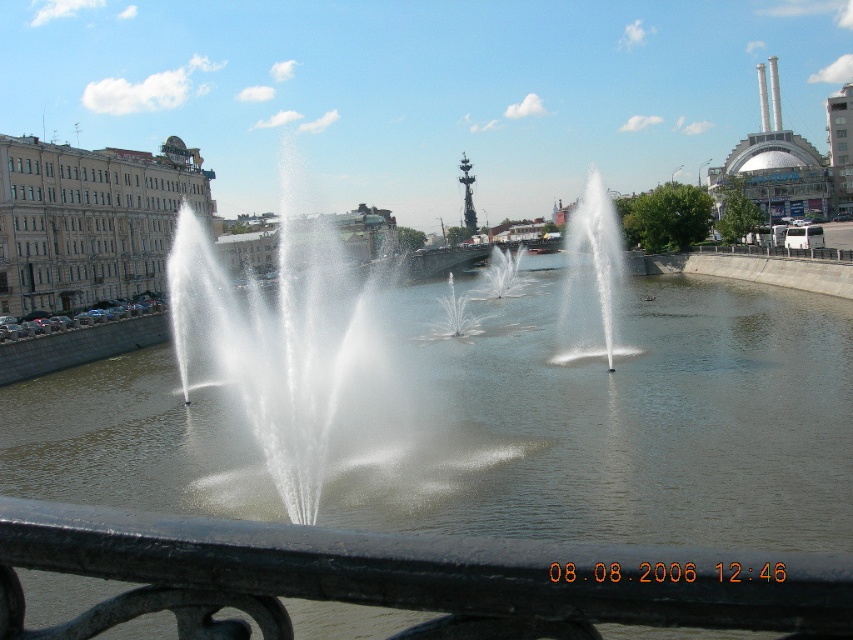
Who is positioned more to the left, brown concrete river at center or black metal rail at lower center?

Positioned to the left is brown concrete river at center.

Can you confirm if brown concrete river at center is bigger than black metal rail at lower center?

Yes.

Is point (219, 396) farther from viewer compared to point (283, 634)?

Yes, it is behind point (283, 634).

Locate an element on the screen. Image resolution: width=853 pixels, height=640 pixels. brown concrete river at center is located at coordinates (619, 420).

Between black metal rail at lower center and white frothy water at center, which one is positioned higher?

Positioned higher is white frothy water at center.

Is point (415, 596) farther from camera compared to point (592, 170)?

No, (415, 596) is in front of (592, 170).

Based on the photo, who is more forward, (669, 568) or (569, 323)?

Point (669, 568) is in front.

The width and height of the screenshot is (853, 640). Find the location of `black metal rail at lower center`. black metal rail at lower center is located at coordinates [401, 579].

Is point (503, 470) behind point (589, 196)?

No, it is in front of (589, 196).

Between brown concrete river at center and white frothy water at center, which one appears on the left side from the viewer's perspective?

Positioned to the left is brown concrete river at center.

At what (x,y) coordinates should I click in order to perform the action: click on brown concrete river at center. Please return your answer as a coordinate pair (x, y). This screenshot has width=853, height=640. Looking at the image, I should click on (619, 420).